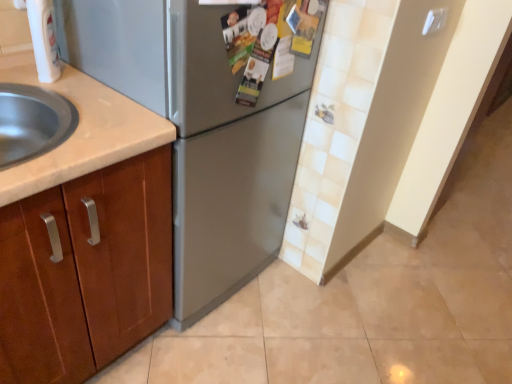
At what (x,y) coordinates should I click in order to perform the action: click on satin silver refrigerator at center. Please return your answer as a coordinate pair (x, y). The image size is (512, 384). Looking at the image, I should click on (201, 133).

This screenshot has height=384, width=512. What do you see at coordinates (201, 133) in the screenshot? I see `satin silver refrigerator at center` at bounding box center [201, 133].

This screenshot has height=384, width=512. Describe the element at coordinates (42, 38) in the screenshot. I see `white plastic faucet at upper left` at that location.

I want to click on white plastic faucet at upper left, so click(42, 38).

The height and width of the screenshot is (384, 512). What are the coordinates of `satin silver refrigerator at center` in the screenshot? It's located at (201, 133).

Which object is positioned more to the left, satin silver refrigerator at center or white plastic faucet at upper left?

From the viewer's perspective, white plastic faucet at upper left appears more on the left side.

Does satin silver refrigerator at center come in front of white plastic faucet at upper left?

Yes, it is.

In the scene shown: Which is closer, (x=207, y=23) or (x=49, y=25)?

Point (x=207, y=23) appears to be closer to the viewer than point (x=49, y=25).

From the image's perspective, is satin silver refrigerator at center located above white plastic faucet at upper left?

Incorrect, from the image's perspective, satin silver refrigerator at center is lower than white plastic faucet at upper left.

From a real-world perspective, which is physically above, satin silver refrigerator at center or white plastic faucet at upper left?

white plastic faucet at upper left is physically above.

Is satin silver refrigerator at center wider or thinner than white plastic faucet at upper left?

satin silver refrigerator at center is wider than white plastic faucet at upper left.

Between satin silver refrigerator at center and white plastic faucet at upper left, which one has less height?

white plastic faucet at upper left is shorter.

Between satin silver refrigerator at center and white plastic faucet at upper left, which one has larger size?

satin silver refrigerator at center.

Is satin silver refrigerator at center located outside white plastic faucet at upper left?

Yes, satin silver refrigerator at center is located beyond the bounds of white plastic faucet at upper left.

Can you see satin silver refrigerator at center touching white plastic faucet at upper left?

No, satin silver refrigerator at center is not beside white plastic faucet at upper left.

Is satin silver refrigerator at center oriented away from white plastic faucet at upper left?

That's not correct — satin silver refrigerator at center is not looking away from white plastic faucet at upper left.

Find the location of a particular element. refrigerator in front of the white plastic faucet at upper left is located at coordinates (201, 133).

Between white plastic faucet at upper left and satin silver refrigerator at center, which one appears on the right side from the viewer's perspective?

Positioned to the right is satin silver refrigerator at center.

Considering their positions, is white plastic faucet at upper left located in front of or behind satin silver refrigerator at center?

In the image, white plastic faucet at upper left appears behind satin silver refrigerator at center.

Between point (48, 67) and point (283, 86), which one is positioned in front?

Point (48, 67)

In the scene shown: From the image's perspective, is white plastic faucet at upper left located above satin silver refrigerator at center?

Yes, from the image's perspective, white plastic faucet at upper left is above satin silver refrigerator at center.

From the picture: From a real-world perspective, is white plastic faucet at upper left located higher than satin silver refrigerator at center?

Indeed, from a real-world perspective, white plastic faucet at upper left stands above satin silver refrigerator at center.

Based on the photo, which object is wider, white plastic faucet at upper left or satin silver refrigerator at center?

satin silver refrigerator at center is wider.

Is white plastic faucet at upper left taller or shorter than satin silver refrigerator at center?

In the image, white plastic faucet at upper left appears to be shorter than satin silver refrigerator at center.

Is white plastic faucet at upper left smaller than satin silver refrigerator at center?

Yes, white plastic faucet at upper left is smaller than satin silver refrigerator at center.

Would you say white plastic faucet at upper left contains satin silver refrigerator at center?

No, satin silver refrigerator at center is not inside white plastic faucet at upper left.

Is white plastic faucet at upper left in contact with satin silver refrigerator at center?

No, white plastic faucet at upper left is not beside satin silver refrigerator at center.

Is white plastic faucet at upper left positioned with its back to satin silver refrigerator at center?

Yes, white plastic faucet at upper left's orientation is away from satin silver refrigerator at center.

What are the coordinates of `refrigerator below the white plastic faucet at upper left (from a real-world perspective)` in the screenshot? It's located at (201, 133).

You are a GUI agent. You are given a task and a screenshot of the screen. Output one action in this format:
    pyautogui.click(x=<x>, y=<y>)
    Task: Click on the refrigerator that is in front of the white plastic faucet at upper left
    Image resolution: width=512 pixels, height=384 pixels.
    Given the screenshot: What is the action you would take?
    pyautogui.click(x=201, y=133)

The width and height of the screenshot is (512, 384). In the image, there is a white plastic faucet at upper left. What are the coordinates of `refrigerator below it (from the image's perspective)` in the screenshot? It's located at (201, 133).